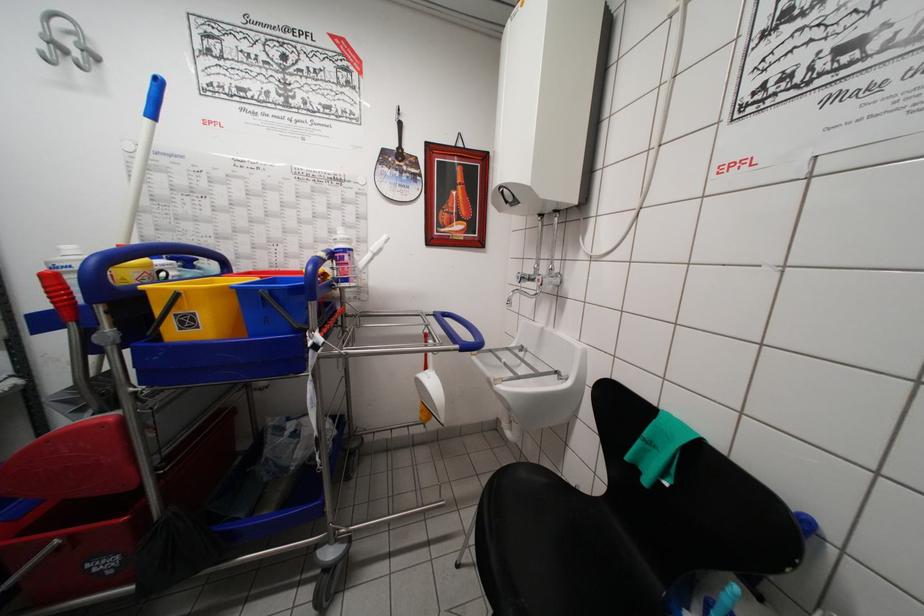
The width and height of the screenshot is (924, 616). I want to click on blue rack handle, so click(131, 267).